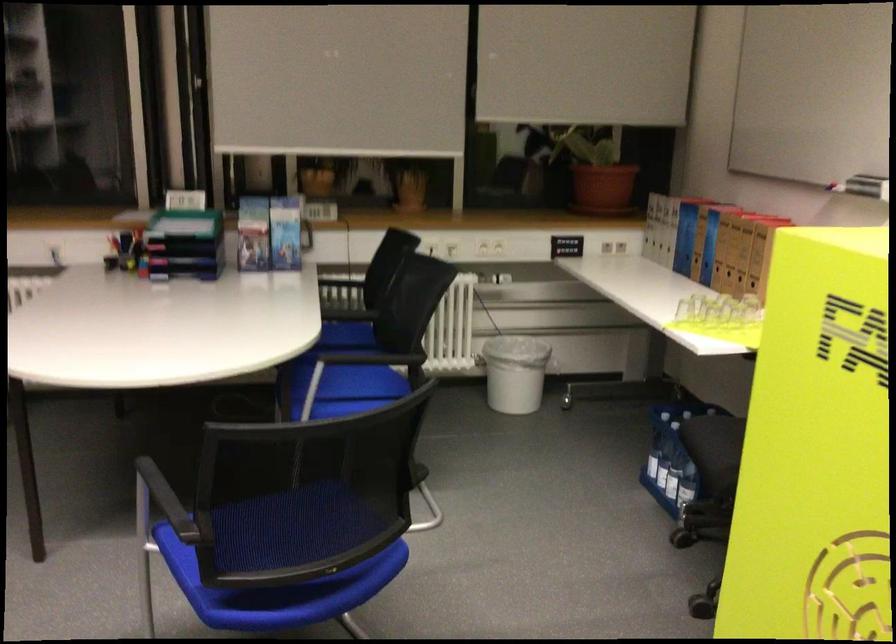
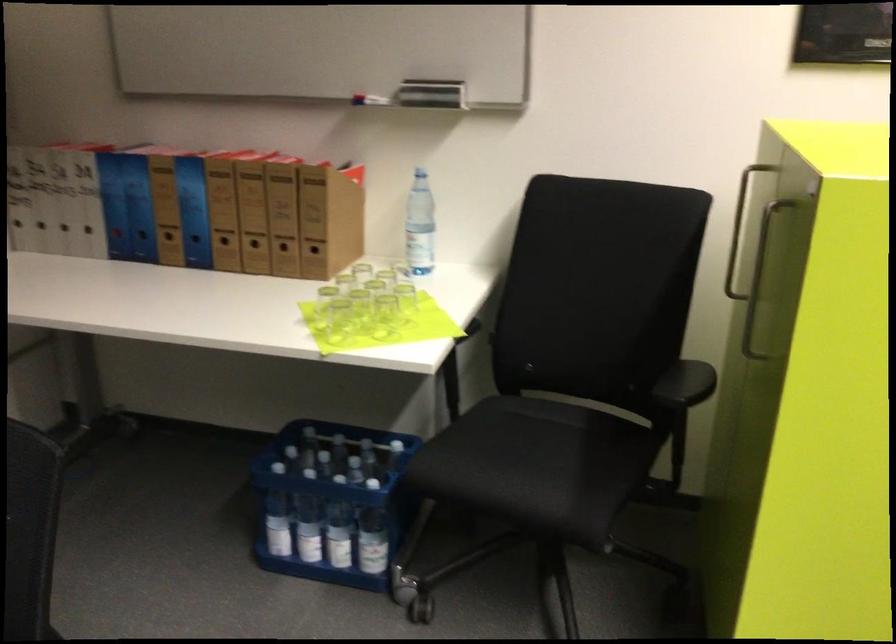
Find the pixel in the second image that matches (736,324) in the first image.

(383, 316)